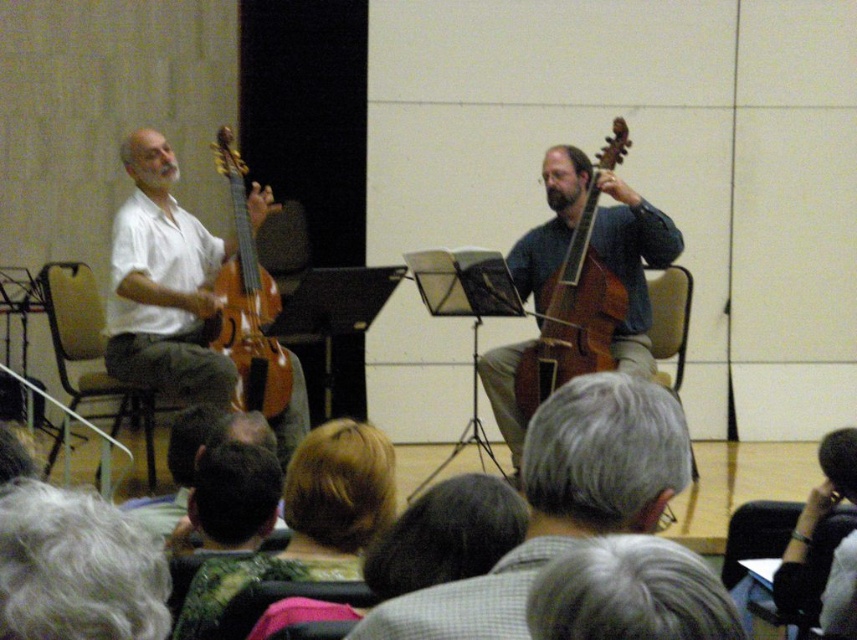
Is gray curly hair at lower left to the left of brown wood cello at center from the viewer's perspective?

Correct, you'll find gray curly hair at lower left to the left of brown wood cello at center.

Does gray curly hair at lower left appear under brown wood cello at center?

Yes, gray curly hair at lower left is below brown wood cello at center.

Measure the distance between point (111,557) and camera.

Point (111,557) and camera are 39.36 inches apart from each other.

Locate an element on the screen. The image size is (857, 640). gray curly hair at lower left is located at coordinates (76, 568).

Can you confirm if matte wood violin at left is positioned to the left of gray curly hair at lower left?

Yes, matte wood violin at left is to the left of gray curly hair at lower left.

Does matte wood violin at left come in front of gray curly hair at lower left?

That is False.

Does point (129, 381) come behind point (154, 625)?

Yes, it is behind point (154, 625).

Where is `matte wood violin at left`? matte wood violin at left is located at coordinates (165, 285).

Consider the image. Can you confirm if gray curly hair at lower left is smaller than black leather glove at lower right?

Yes.

This screenshot has width=857, height=640. Identify the location of gray curly hair at lower left. (76, 568).